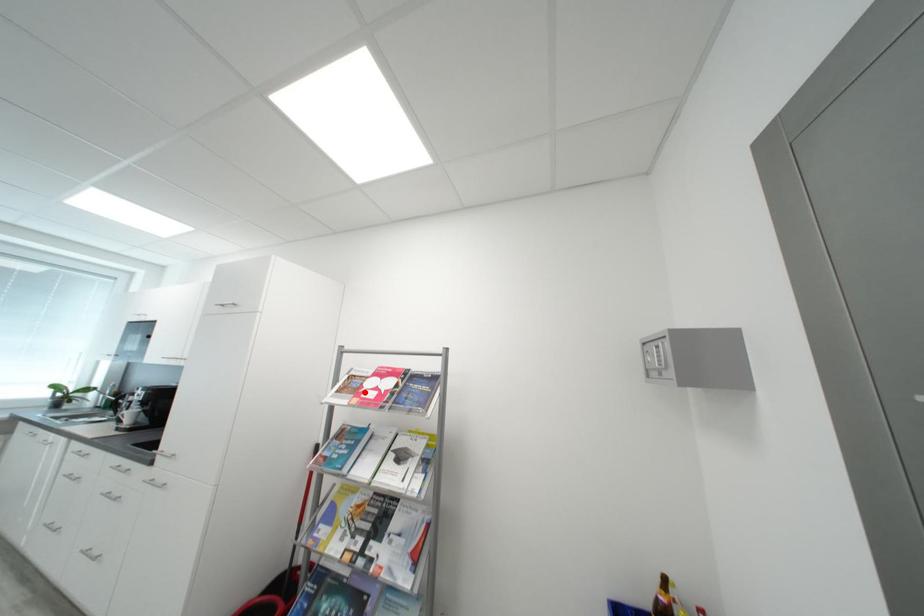
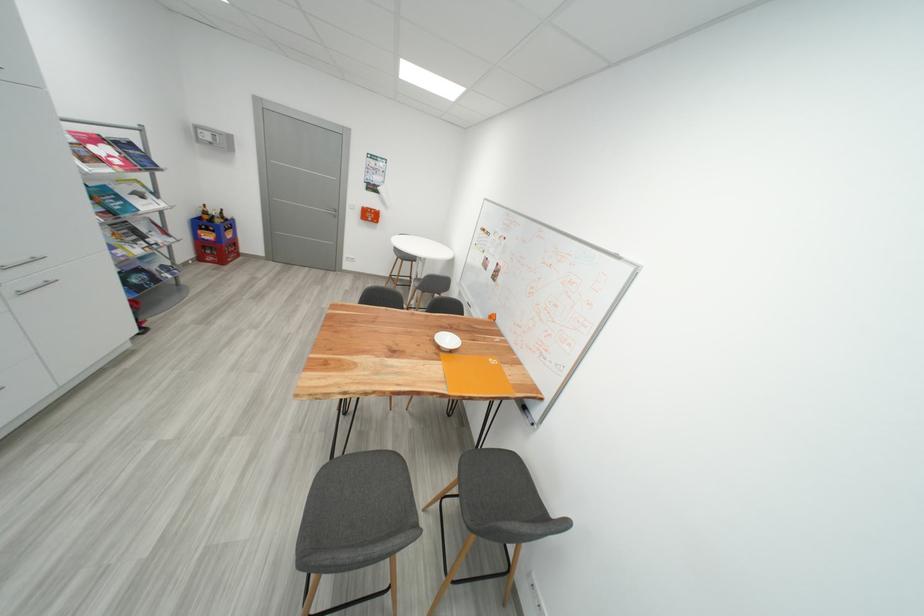
Where in the second image is the point corresponding to the highlighted location from the first image?

(104, 161)